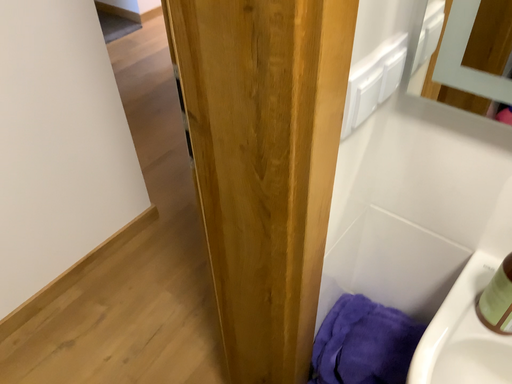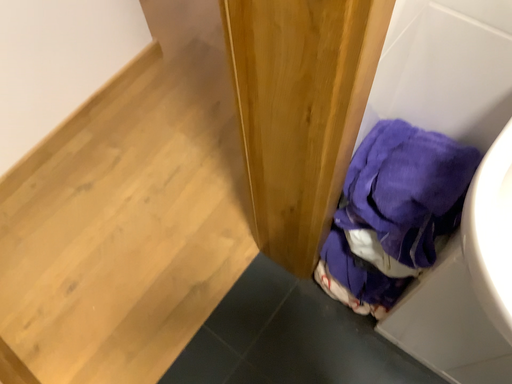
Question: How did the camera likely rotate when shooting the video?

Choices:
 (A) rotated downward
 (B) rotated upward

Answer: (A)